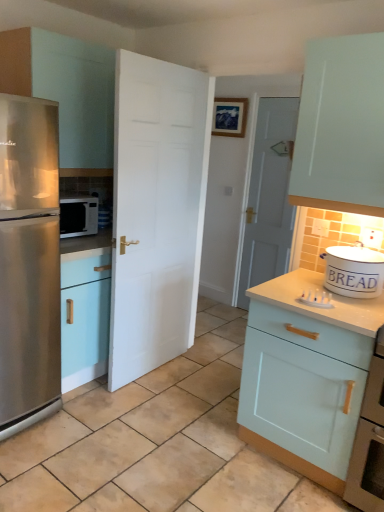
Question: Is the depth of white matte door at center, marked as the second door in a back-to-front arrangement, greater than that of satin silver microwave at left?

Choices:
 (A) no
 (B) yes

Answer: (A)

Question: From a real-world perspective, is white matte door at center, which ranks as the 2th door in right-to-left order, beneath satin silver microwave at left?

Choices:
 (A) no
 (B) yes

Answer: (B)

Question: Is white matte door at center, the 1th door viewed from the front, wider than satin silver microwave at left?

Choices:
 (A) no
 (B) yes

Answer: (A)

Question: Can you confirm if white matte door at center, marked as the second door in a back-to-front arrangement, is positioned to the right of satin silver microwave at left?

Choices:
 (A) no
 (B) yes

Answer: (B)

Question: Considering the relative sizes of white matte door at center, the 1th door viewed from the front, and satin silver microwave at left in the image provided, is white matte door at center, the 1th door viewed from the front, bigger than satin silver microwave at left?

Choices:
 (A) no
 (B) yes

Answer: (B)

Question: From the image's perspective, is white matte door at center, which ranks as the 2th door in right-to-left order, located beneath satin silver microwave at left?

Choices:
 (A) yes
 (B) no

Answer: (A)

Question: Can you see white matte door at center, positioned as the 1th door in left-to-right order, touching light blue wood cabinet at right, which is counted as the first cabinetry, starting from the right?

Choices:
 (A) yes
 (B) no

Answer: (B)

Question: Is white matte door at center, marked as the second door in a back-to-front arrangement, aimed at light blue wood cabinet at right, which is counted as the first cabinetry, starting from the right?

Choices:
 (A) yes
 (B) no

Answer: (A)

Question: From the image's perspective, is white matte door at center, which ranks as the 2th door in right-to-left order, located above light blue wood cabinet at right, the first cabinetry from the bottom?

Choices:
 (A) yes
 (B) no

Answer: (A)

Question: Is white matte door at center, the 1th door viewed from the front, facing away from light blue wood cabinet at right, the second cabinetry positioned from the left?

Choices:
 (A) yes
 (B) no

Answer: (B)

Question: From a real-world perspective, is white matte door at center, which ranks as the 2th door in right-to-left order, positioned under light blue wood cabinet at right, the second cabinetry positioned from the left, based on gravity?

Choices:
 (A) yes
 (B) no

Answer: (B)

Question: Considering the relative sizes of white matte door at center, which ranks as the 2th door in right-to-left order, and light blue wood cabinet at right, the second cabinetry positioned from the left, in the image provided, is white matte door at center, which ranks as the 2th door in right-to-left order, wider than light blue wood cabinet at right, the second cabinetry positioned from the left,?

Choices:
 (A) yes
 (B) no

Answer: (B)

Question: Is light blue wood cabinet at right, the first cabinetry from the bottom, surrounded by white wooden door at center, the second door from the left?

Choices:
 (A) no
 (B) yes

Answer: (A)